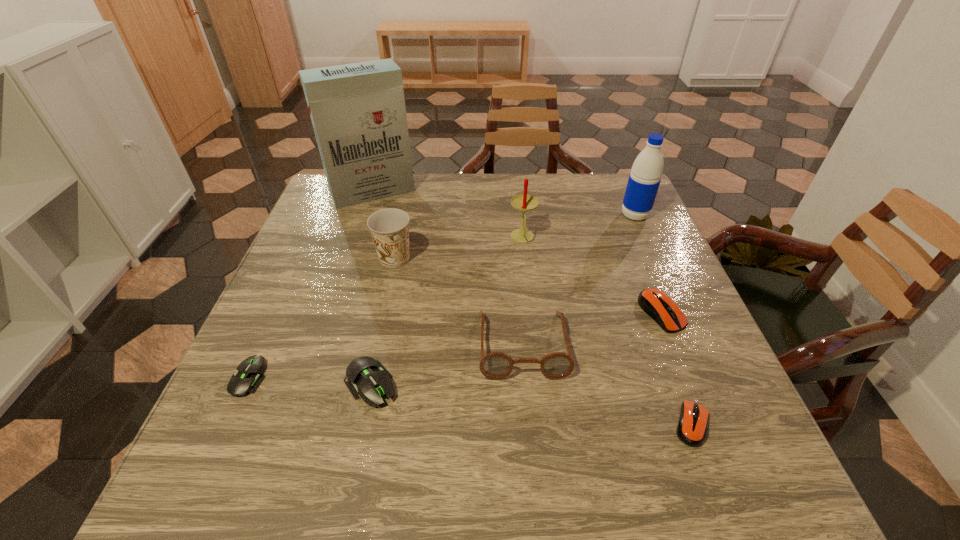
Find the location of a particular element. This screenshot has height=540, width=960. cigarette case is located at coordinates (358, 113).

The height and width of the screenshot is (540, 960). In order to click on water bottle in this screenshot , I will do `click(645, 177)`.

Find the location of `blue water bottle`. blue water bottle is located at coordinates (645, 177).

The height and width of the screenshot is (540, 960). What are the coordinates of `the seventh shortest object` in the screenshot? It's located at (523, 202).

Locate an element on the screen. The height and width of the screenshot is (540, 960). Dixie cup is located at coordinates (389, 228).

I want to click on the sixth shortest object, so click(x=389, y=228).

The image size is (960, 540). Find the location of `spectacles`. spectacles is located at coordinates [x=496, y=365].

Where is `the farthest computer mouse`? The image size is (960, 540). the farthest computer mouse is located at coordinates (660, 307).

You are a GUI agent. You are given a task and a screenshot of the screen. Output one action in this format:
    pyautogui.click(x=<x>, y=<y>)
    Task: Click on the farther orange computer mouse
    This screenshot has width=960, height=540.
    Given the screenshot: What is the action you would take?
    pyautogui.click(x=660, y=307)

Identify the location of the right gray computer mouse. The image size is (960, 540). (364, 375).